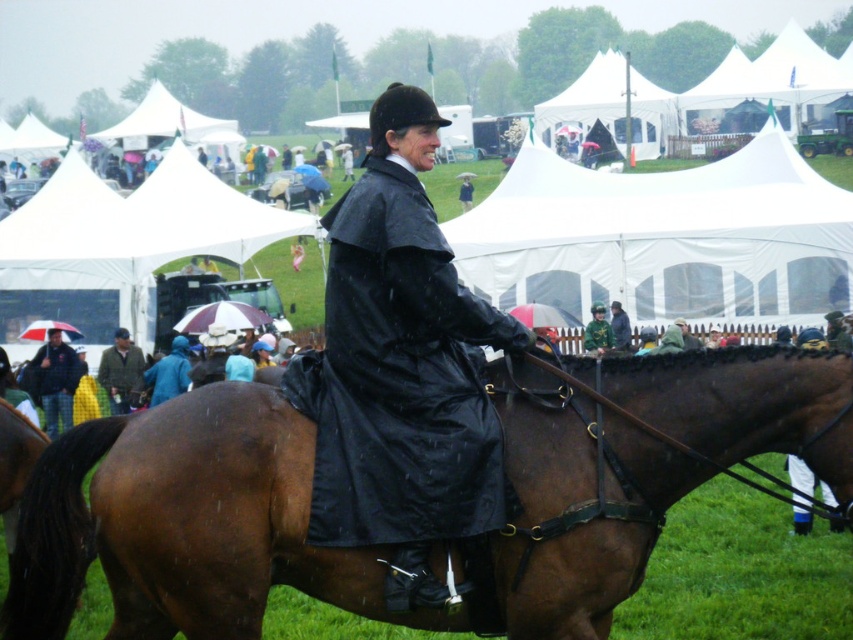
You are a spectator at the event and want to take a photo of the plaid fabric jacket at lower left without the white canvas tent at upper center blocking the view. Is this possible?

The plaid fabric jacket at lower left is behind the white canvas tent at upper center, so it is already blocked by the tent and cannot be seen without moving the tent or the jacket.

You are a photographer positioned at the origin point of the coordinate system. You want to take a photo of the brown glossy horse at center. What are the coordinates where you should aim your camera?

The coordinates to aim the camera are at point (x=186, y=524) to capture the brown glossy horse at center.